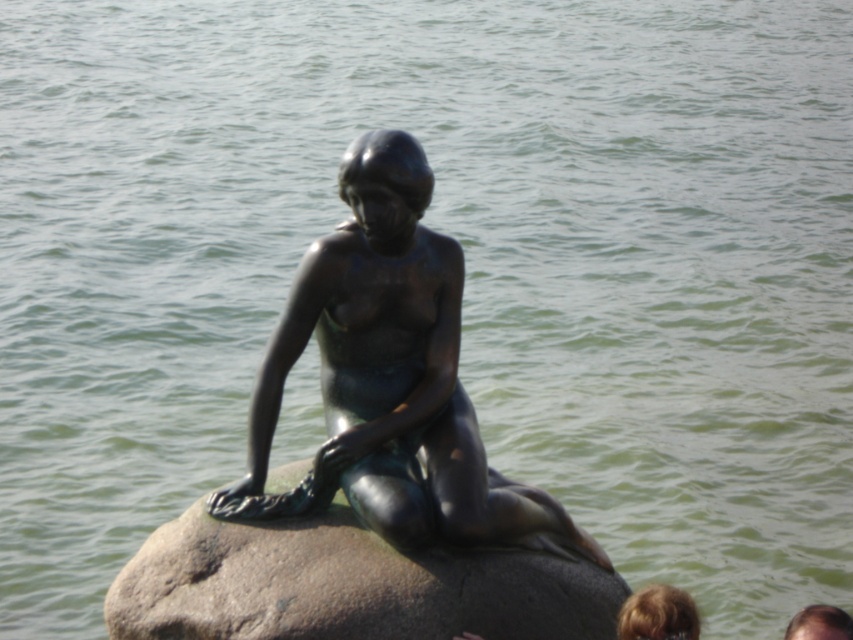
Question: Does bronze statue at center appear on the right side of greenish-gray stone at center?

Choices:
 (A) yes
 (B) no

Answer: (B)

Question: Does bronze statue at center appear on the right side of greenish-gray stone at center?

Choices:
 (A) no
 (B) yes

Answer: (A)

Question: Which of the following is the closest to the observer?

Choices:
 (A) greenish-gray stone at center
 (B) bronze statue at center

Answer: (A)

Question: Which point is closer to the camera taking this photo?

Choices:
 (A) (412, 593)
 (B) (410, 544)

Answer: (A)

Question: Can you confirm if bronze statue at center is positioned to the right of greenish-gray stone at center?

Choices:
 (A) yes
 (B) no

Answer: (B)